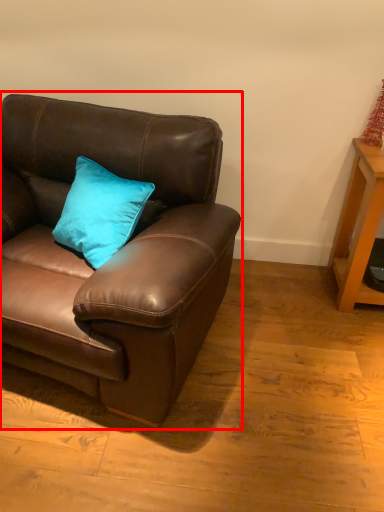
Question: From the image's perspective, what is the correct spatial relationship of studio couch (annotated by the red box) in relation to table?

Choices:
 (A) above
 (B) below

Answer: (B)